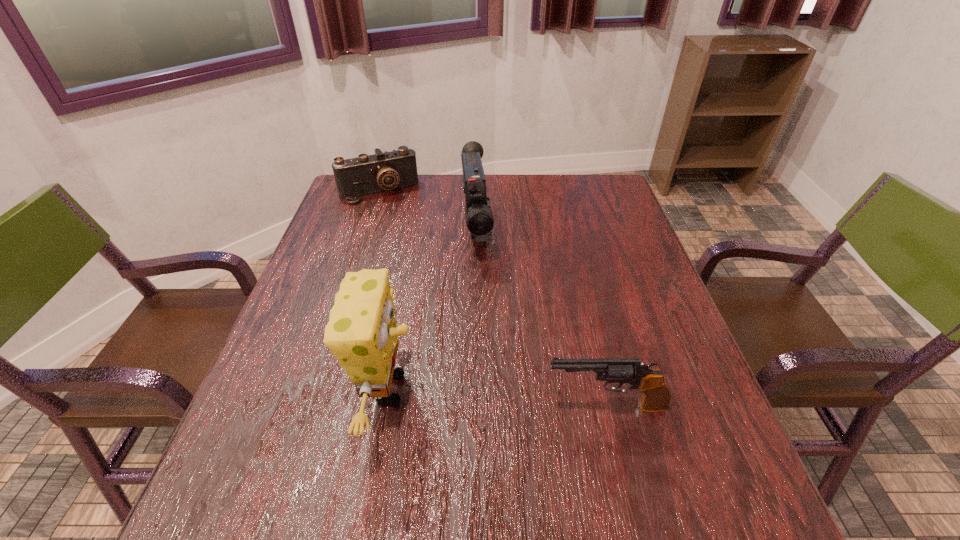
The width and height of the screenshot is (960, 540). I want to click on sponge, so click(x=361, y=332).

You are a GUI agent. You are given a task and a screenshot of the screen. Output one action in this format:
    pyautogui.click(x=<x>, y=<y>)
    Task: Click on the gun
    Image resolution: width=960 pixels, height=540 pixels.
    Given the screenshot: What is the action you would take?
    pyautogui.click(x=656, y=396)

Locate an element on the screen. This screenshot has height=540, width=960. the second object from right to left is located at coordinates (479, 218).

You are a GUI agent. You are given a task and a screenshot of the screen. Output one action in this format:
    pyautogui.click(x=<x>, y=<y>)
    Task: Click on the camcorder
    
    Given the screenshot: What is the action you would take?
    pyautogui.click(x=479, y=218)

Where is `the shortest object`? The image size is (960, 540). the shortest object is located at coordinates (367, 174).

The height and width of the screenshot is (540, 960). Identify the location of vacant area located 0.300m on the face of the sponge. (569, 389).

The image size is (960, 540). I want to click on vacant region located along the barrel of the gun, so [x=482, y=406].

Locate an element on the screen. The height and width of the screenshot is (540, 960). free spot located 0.050m along the barrel of the gun is located at coordinates (518, 406).

Find the location of a particular element. This screenshot has height=540, width=960. vacant area located 0.140m along the barrel of the gun is located at coordinates (471, 406).

Where is `vacant area situated 0.050m on the front-facing side of the second object from right to left`? vacant area situated 0.050m on the front-facing side of the second object from right to left is located at coordinates (480, 279).